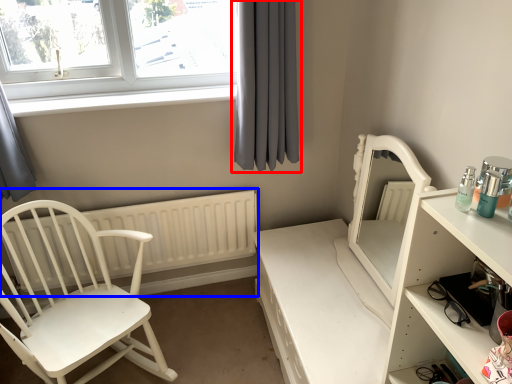
Question: Among these objects, which one is farthest to the camera, curtain (highlighted by a red box) or radiator (highlighted by a blue box)?

Choices:
 (A) curtain
 (B) radiator

Answer: (B)